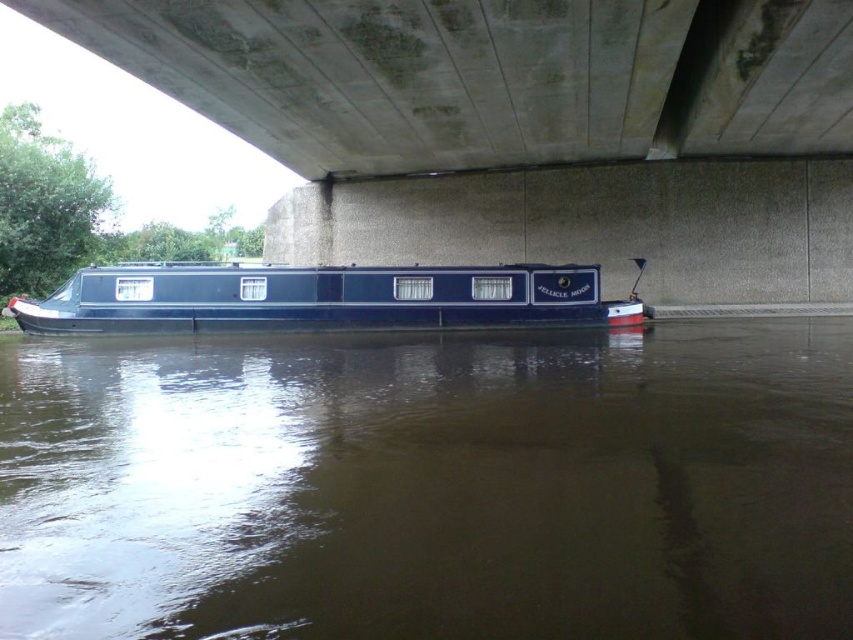
You are a photographer standing on the bridge above the water. You want to capture a photo of the shiny blue boat at center without the brown murky water at center appearing in the foreground. Is this possible based on their positions?

The brown murky water at center is in front of the shiny blue boat at center, so it would block the view of the boat from above. Therefore, it is not possible to take a photo of the shiny blue boat at center without the brown murky water at center appearing in the foreground.

You are standing on the deck of the narrowboat and looking towards the bridge. Which object is closer to you, the brown murky water at center or the concrete at upper center?

The brown murky water at center is closer to you because it is to the left of the concrete at upper center.

You are a delivery person needing to lower a package from the concrete at upper center down to the shiny blue boat at center. The package is 5 meters long. Can you safely lower it without the package getting stuck between the two objects?

The distance between the concrete at upper center and the shiny blue boat at center is 5.18 meters. Since the package is 5 meters long, there is enough space to lower it safely without getting stuck.